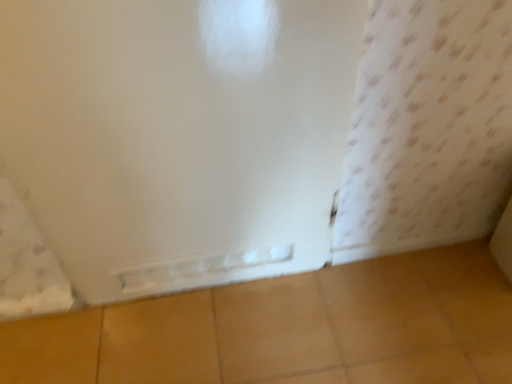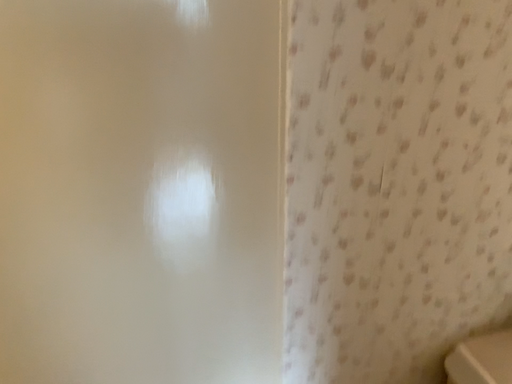
Question: Which way did the camera rotate in the video?

Choices:
 (A) rotated upward
 (B) rotated downward

Answer: (A)